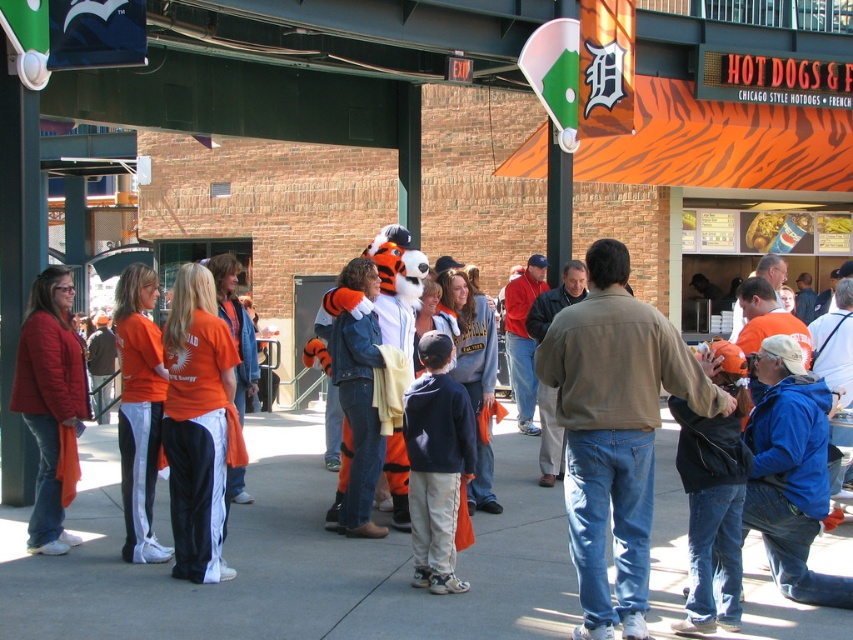
Question: Does matte orange jacket at left appear on the right side of dark blue fleece jacket at center?

Choices:
 (A) yes
 (B) no

Answer: (B)

Question: Estimate the real-world distances between objects in this image. Which object is closer to the denim jacket at center?

Choices:
 (A) black leather jacket at center
 (B) matte orange jacket at left
 (C) orange fabric shirt at center
 (D) dark blue fleece jacket at center

Answer: (D)

Question: Is concrete sidewalk at center smaller than black leather jacket at center?

Choices:
 (A) yes
 (B) no

Answer: (A)

Question: Which object is the closest to the brown leather jacket at center?

Choices:
 (A) blue fleece jacket at right
 (B) orange fabric shirt at center
 (C) orange fabric pants at center

Answer: (A)

Question: Which point is closer to the camera?

Choices:
 (A) (650, 365)
 (B) (132, 544)
 (C) (695, 614)
 (D) (270, 468)

Answer: (A)

Question: Can you confirm if concrete sidewalk at center is wider than denim jacket at center?

Choices:
 (A) yes
 (B) no

Answer: (A)